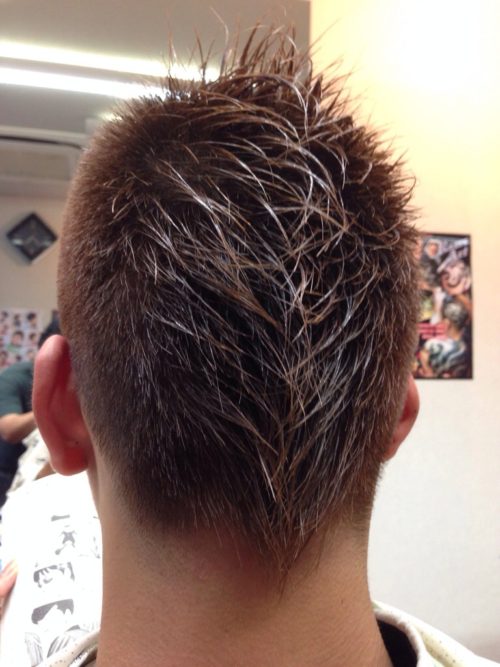
Image resolution: width=500 pixels, height=667 pixels. What are the coordinates of `ceiling` in the screenshot? It's located at (53, 117).